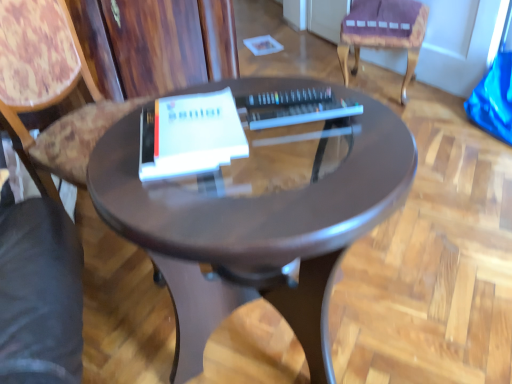
Where is `free space to the left of white matte paperback book at center`? The image size is (512, 384). free space to the left of white matte paperback book at center is located at coordinates (115, 155).